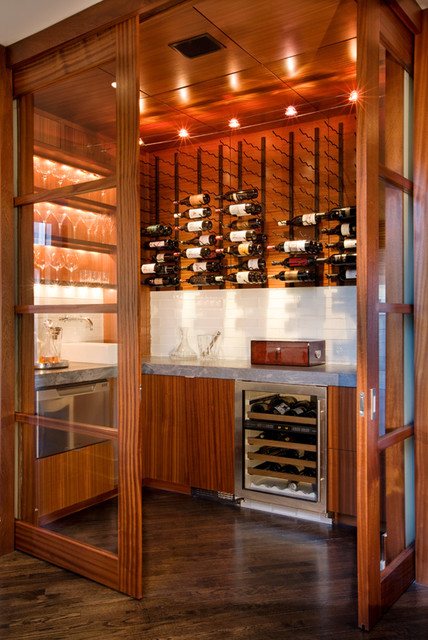
Locate an element on the screen. The image size is (428, 640). wooden door is located at coordinates (128, 512).